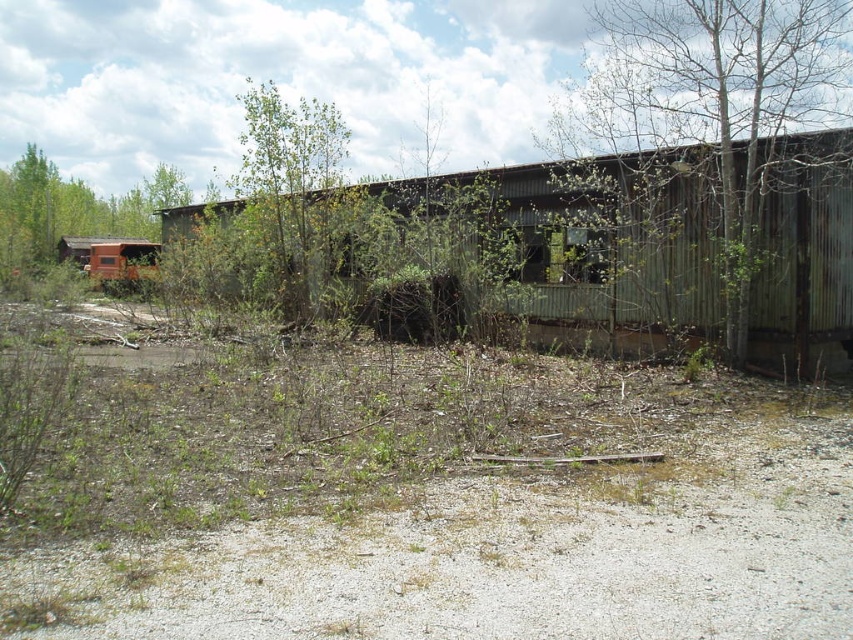
How distant is rusty corrugated metal hut at center from brown wood tree at left?

The distance of rusty corrugated metal hut at center from brown wood tree at left is 16.50 meters.

Does rusty corrugated metal hut at center come in front of brown wood tree at left?

Yes, rusty corrugated metal hut at center is closer to the viewer.

Identify the location of rusty corrugated metal hut at center. (601, 236).

The width and height of the screenshot is (853, 640). I want to click on rusty corrugated metal hut at center, so click(601, 236).

Which is more to the right, dull brown dirt at center or brown wood tree at left?

From the viewer's perspective, dull brown dirt at center appears more on the right side.

Does point (734, 538) come in front of point (151, 182)?

That is True.

Is point (24, 506) farther from viewer compared to point (3, 252)?

No, (24, 506) is closer to viewer.

This screenshot has width=853, height=640. In order to click on dull brown dirt at center in this screenshot , I will do `click(432, 500)`.

Consider the image. Does green textured tree at upper right have a lesser height compared to green leafy tree at center?

Incorrect, green textured tree at upper right's height does not fall short of green leafy tree at center's.

Is green textured tree at upper right to the right of green leafy tree at center from the viewer's perspective?

Correct, you'll find green textured tree at upper right to the right of green leafy tree at center.

Is point (618, 54) positioned after point (292, 228)?

No, (618, 54) is in front of (292, 228).

This screenshot has height=640, width=853. Identify the location of green textured tree at upper right. (712, 99).